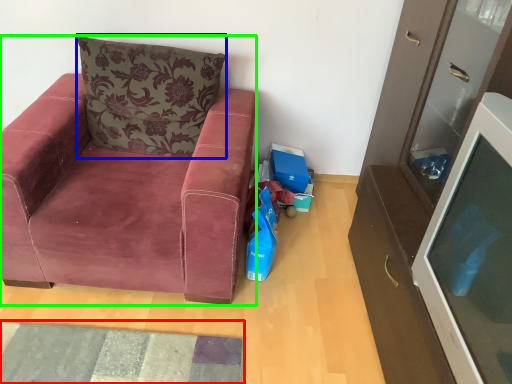
Question: Which object is the farthest from mat (highlighted by a red box)? Choose among these: pillow (highlighted by a blue box) or chair (highlighted by a green box).

Choices:
 (A) pillow
 (B) chair

Answer: (A)